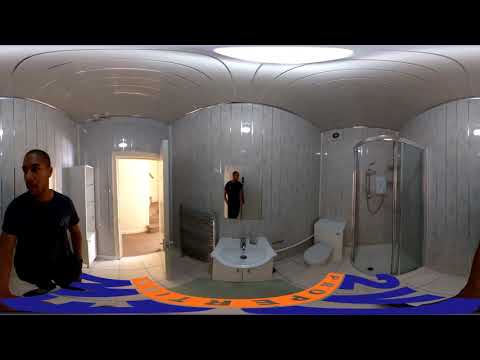
Image resolution: width=480 pixels, height=360 pixels. I want to click on sink, so click(242, 256).